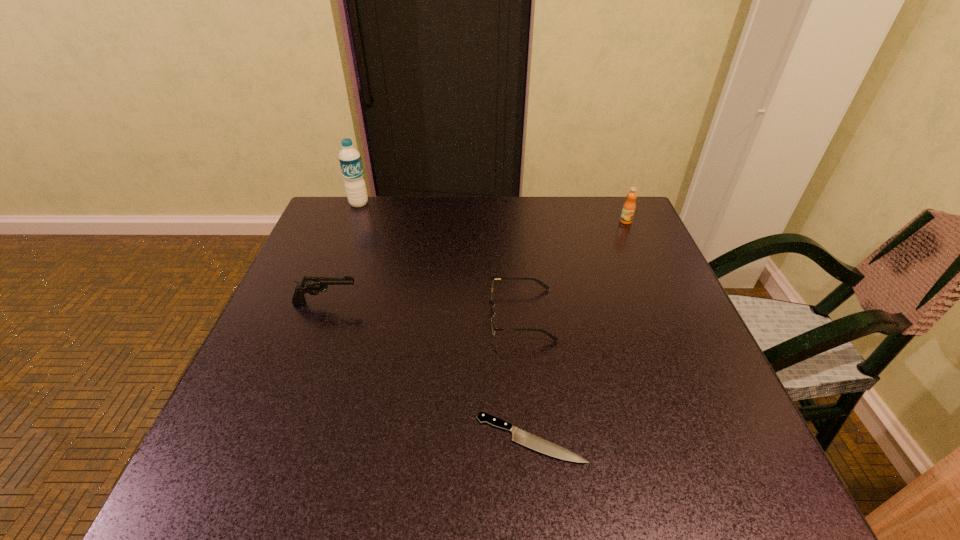
You are a GUI agent. You are given a task and a screenshot of the screen. Output one action in this format:
    pyautogui.click(x=<x>, y=<y>)
    Task: Click on the farthest object
    This screenshot has height=540, width=960.
    Given the screenshot: What is the action you would take?
    pyautogui.click(x=350, y=161)

Identify the location of water bottle. (350, 161).

Find the location of a particular element. This screenshot has height=540, width=960. the rightmost object is located at coordinates [x=629, y=206].

You are a GUI agent. You are given a task and a screenshot of the screen. Output one action in this format:
    pyautogui.click(x=<x>, y=<y>)
    Task: Click on the fourth shortest object
    The image size is (960, 540).
    Given the screenshot: What is the action you would take?
    pyautogui.click(x=629, y=206)

Image resolution: width=960 pixels, height=540 pixels. Identify the location of gun. (313, 285).

Find the location of a particular element. the second shortest object is located at coordinates (542, 284).

The width and height of the screenshot is (960, 540). I want to click on steak knife, so click(522, 437).

You are a GUI agent. You are given a task and a screenshot of the screen. Output one action in this format:
    pyautogui.click(x=<x>, y=<y>)
    Task: Click on the nearest object
    This screenshot has width=960, height=540.
    Given the screenshot: What is the action you would take?
    pyautogui.click(x=522, y=437)

Where is `free location located 0.160m on the label of the water bottle`? The height and width of the screenshot is (540, 960). free location located 0.160m on the label of the water bottle is located at coordinates (345, 242).

At what (x,y) coordinates should I click in order to perform the action: click on vacant space situated 0.400m on the front label of the fourth nearest object. Please return your answer as a coordinate pair (x, y). The width and height of the screenshot is (960, 540). Looking at the image, I should click on (676, 333).